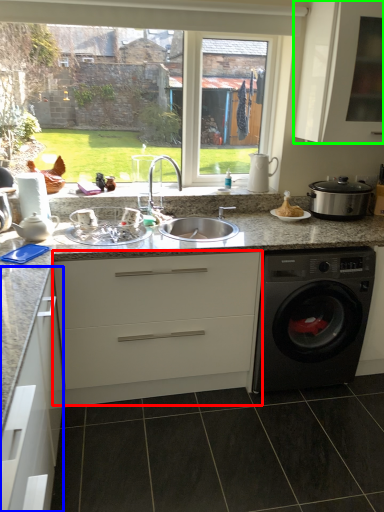
Question: Considering the real-world distances, which object is closest to cabinetry (highlighted by a red box)? cabinetry (highlighted by a blue box) or cabinetry (highlighted by a green box).

Choices:
 (A) cabinetry
 (B) cabinetry

Answer: (A)